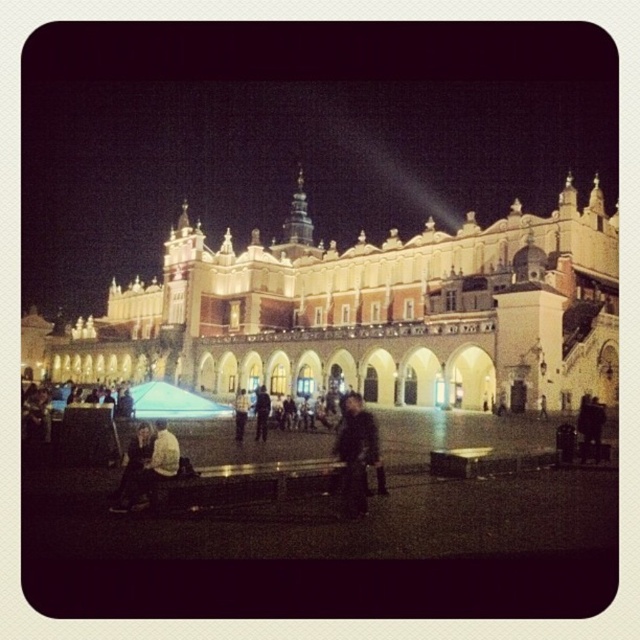
Which is in front, point (147, 440) or point (237, 428)?

Point (147, 440)

Is the position of dark brown leather jacket at lower left less distant than that of light brown leather jacket at center?

Yes.

Does point (145, 449) lie behind point (237, 429)?

No, (145, 449) is in front of (237, 429).

Find the location of `dark brown leather jacket at lower left`. dark brown leather jacket at lower left is located at coordinates (132, 467).

Is light brown stone building at center to the right of dark blue jacket at center from the viewer's perspective?

Correct, you'll find light brown stone building at center to the right of dark blue jacket at center.

Which of these two, light brown stone building at center or dark blue jacket at center, stands taller?

Standing taller between the two is light brown stone building at center.

Locate an element on the screen. This screenshot has width=640, height=640. light brown stone building at center is located at coordinates (372, 314).

Locate an element on the screen. light brown stone building at center is located at coordinates (372, 314).

In the scene shown: Does dark brown leather jacket at center have a larger size compared to dark brown leather jacket at lower left?

Yes, dark brown leather jacket at center is bigger than dark brown leather jacket at lower left.

Does dark brown leather jacket at center have a greater height compared to dark brown leather jacket at lower left?

Yes.

Where is `dark brown leather jacket at center`? This screenshot has height=640, width=640. dark brown leather jacket at center is located at coordinates (356, 452).